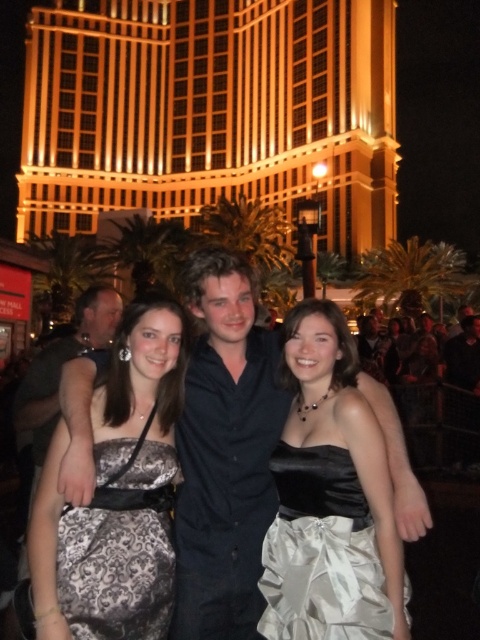
Question: Can you confirm if silver satin dress at center is thinner than satin dress at center?

Choices:
 (A) yes
 (B) no

Answer: (A)

Question: Which point is farther to the camera?

Choices:
 (A) (94, 637)
 (B) (355, 220)
 (C) (287, 598)

Answer: (B)

Question: Does golden glass building at upper center have a greater width compared to silver satin dress at center?

Choices:
 (A) no
 (B) yes

Answer: (B)

Question: Which object is farther from the camera taking this photo?

Choices:
 (A) golden glass building at upper center
 (B) satin dress at center
 (C) silver satin dress at center

Answer: (A)

Question: Can you confirm if silver satin dress at center is positioned below satin dress at center?

Choices:
 (A) yes
 (B) no

Answer: (B)

Question: Which object is positioned closest to the satin dress at center?

Choices:
 (A) silver satin dress at center
 (B) golden glass building at upper center

Answer: (A)